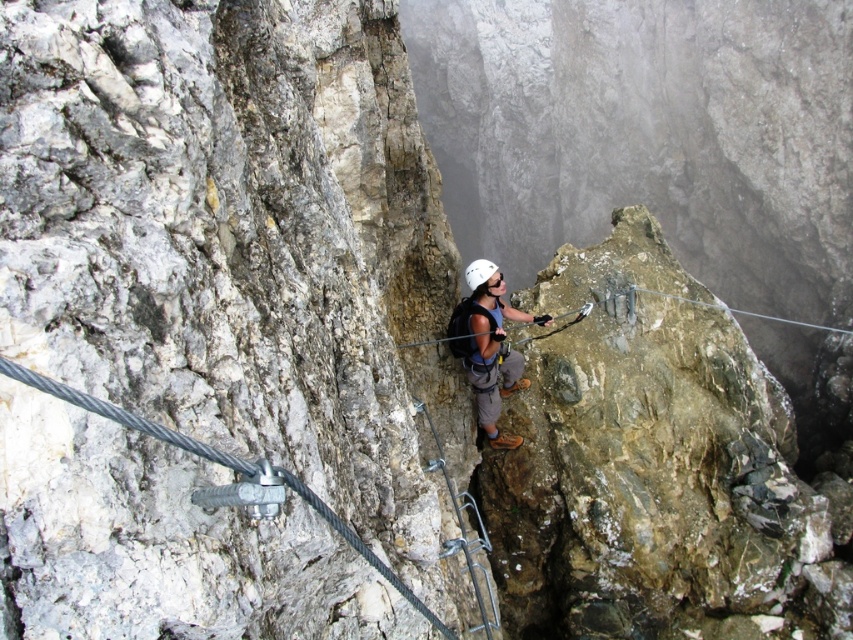
Looking at this image, you are a rock climber preparing to ascend a steep cliff. You notice a metallic wire at center and a white matte helmet at center. Which object is located to the left of the other?

The metallic wire at center is positioned on the left side of white matte helmet at center.